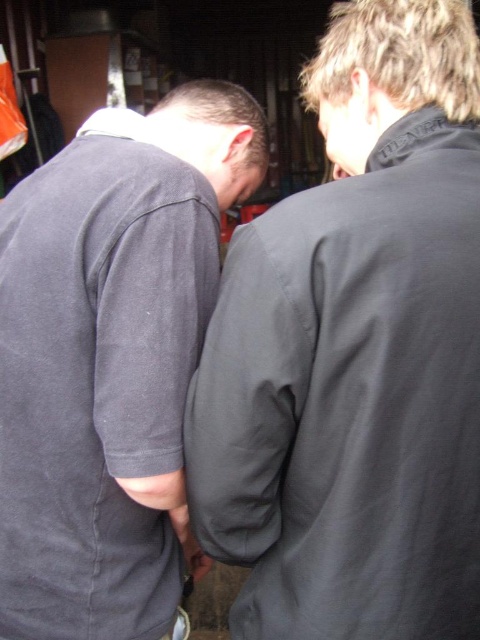
You are an interior designer assessing the layout of a workshop. You notice the dark gray fabric at center and the dark gray cotton shirt at center. Which object is positioned higher in the image?

The dark gray fabric at center is located above the dark gray cotton shirt at center, so it is positioned higher in the image.

You are a tailor working in a workshop. You need to determine which item is taller between the dark gray fabric at center and the dark gray cotton shirt at center. Based on the scene description, which one is taller?

The dark gray fabric at center is taller than the dark gray cotton shirt at center according to the description.

You are an interior designer assessing the layout of a workshop. You notice two dark gray items at the center of the image. Which one is positioned closer to you, the dark gray fabric at center or the dark gray cotton shirt at center?

The dark gray fabric at center is closer to the viewer than the dark gray cotton shirt at center.